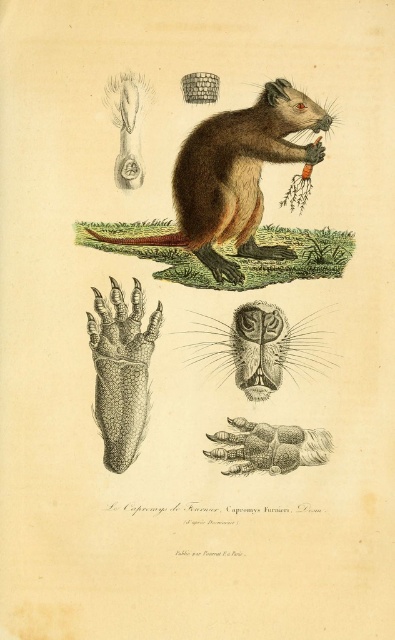
Which is above, smooth brown nose at center or smooth brown paw at center?

smooth brown nose at center is above.

Who is shorter, smooth brown nose at center or smooth brown paw at center?

smooth brown paw at center

Does point (237, 362) come behind point (276, 429)?

Yes, it is behind point (276, 429).

Find the location of a particular element. This screenshot has width=395, height=640. smooth brown nose at center is located at coordinates (257, 348).

Does brown furry beaver at center have a lesser height compared to smooth brown paw at center?

In fact, brown furry beaver at center may be taller than smooth brown paw at center.

You are a GUI agent. You are given a task and a screenshot of the screen. Output one action in this format:
    pyautogui.click(x=<x>, y=<y>)
    Task: Click on the brown furry beaver at center
    Image resolution: width=395 pixels, height=640 pixels.
    Given the screenshot: What is the action you would take?
    pyautogui.click(x=235, y=177)

Find the location of `brown furry beaver at center`. brown furry beaver at center is located at coordinates (235, 177).

Describe the element at coordinates (235, 177) in the screenshot. The width and height of the screenshot is (395, 640). I see `brown furry beaver at center` at that location.

The image size is (395, 640). Identify the location of brown furry beaver at center. (235, 177).

Is point (263, 125) positioned after point (195, 324)?

No, it is not.

At what (x,y) coordinates should I click in order to perform the action: click on brown furry beaver at center. Please return your answer as a coordinate pair (x, y). Image resolution: width=395 pixels, height=640 pixels. Looking at the image, I should click on (235, 177).